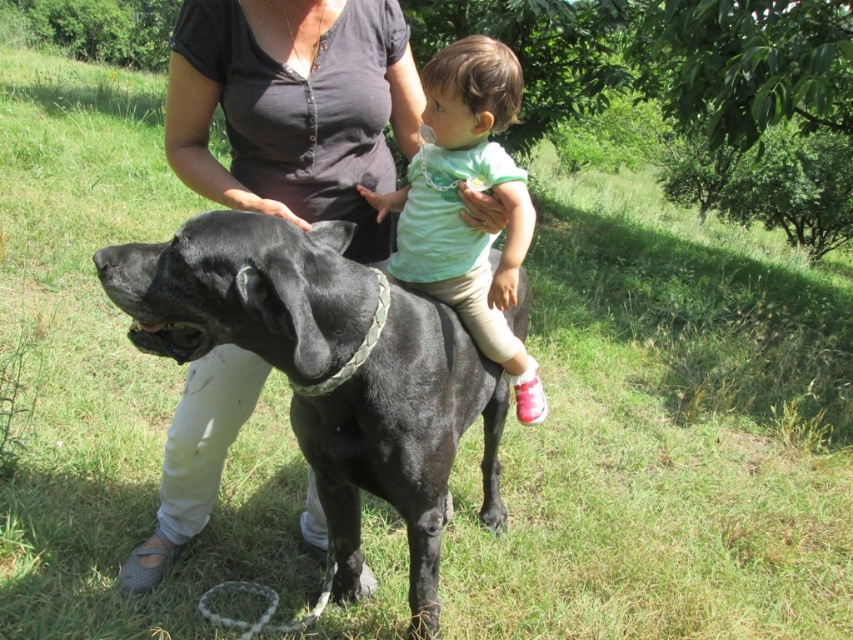
Question: Can you confirm if shiny black dog at center is positioned above matte black shirt at center?

Choices:
 (A) yes
 (B) no

Answer: (B)

Question: Which is nearer to the matte black shirt at center?

Choices:
 (A) shiny black dog at center
 (B) light green fabric shirt at center

Answer: (B)

Question: Which point is farther to the camera?

Choices:
 (A) (479, 243)
 (B) (354, 106)

Answer: (A)

Question: Which object is positioned closest to the shiny black dog at center?

Choices:
 (A) matte black shirt at center
 (B) light green fabric shirt at center

Answer: (B)

Question: Does shiny black dog at center lie behind light green fabric shirt at center?

Choices:
 (A) no
 (B) yes

Answer: (A)

Question: Considering the relative positions of shiny black dog at center and light green fabric shirt at center in the image provided, where is shiny black dog at center located with respect to light green fabric shirt at center?

Choices:
 (A) below
 (B) above

Answer: (A)